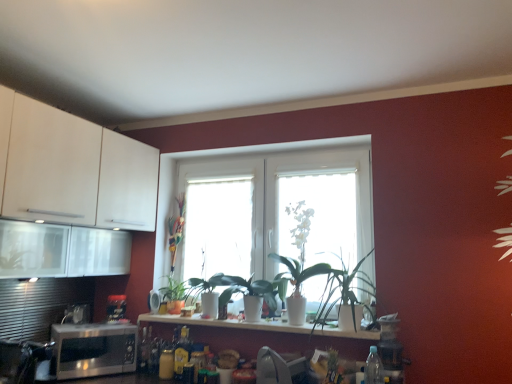
Describe the element at coordinates (225, 323) in the screenshot. I see `white glossy countertop at center` at that location.

Measure the distance between point (236, 230) and camera.

Point (236, 230) is 9.80 feet away from camera.

Measure the distance between white glossy window at center, the 2th window positioned from the left, and camera.

white glossy window at center, the 2th window positioned from the left, is 8.15 feet from camera.

Image resolution: width=512 pixels, height=384 pixels. Describe the element at coordinates (73, 169) in the screenshot. I see `white matte cabinet at upper left` at that location.

Where is `white glossy countertop at center`? Image resolution: width=512 pixels, height=384 pixels. white glossy countertop at center is located at coordinates (225, 323).

Who is bigger, white glossy vase at center, which is the fourth plant in left-to-right order, or transparent glass window at center, which is the third window in right-to-left order?

Bigger between the two is white glossy vase at center, which is the fourth plant in left-to-right order.

Could you tell me if white glossy vase at center, which is the fourth plant in left-to-right order, is turned towards transparent glass window at center, which is counted as the 1th window, starting from the left?

No, white glossy vase at center, which is the fourth plant in left-to-right order, is not facing towards transparent glass window at center, which is counted as the 1th window, starting from the left.

Considering the sizes of objects white glossy vase at center, the second plant viewed from the right, and transparent glass window at center, which is the third window in right-to-left order, in the image provided, who is wider, white glossy vase at center, the second plant viewed from the right, or transparent glass window at center, which is the third window in right-to-left order,?

white glossy vase at center, the second plant viewed from the right.

From the image's perspective, would you say metallic black toaster at lower left, the 2th appliance positioned from the left, is positioned over green glossy plant at center, which appears as the 3th plant when viewed from the left?

No, from the image's perspective, metallic black toaster at lower left, the 2th appliance positioned from the left, is not on top of green glossy plant at center, which appears as the 3th plant when viewed from the left.

Is metallic black toaster at lower left, the 2th appliance positioned from the left, to the left of green glossy plant at center, which appears as the 3th plant when viewed from the left, from the viewer's perspective?

Yes.

From the picture: In terms of height, does metallic black toaster at lower left, the 1th appliance from the right, look taller or shorter compared to green glossy plant at center, the 3th plant from the right?

Clearly, metallic black toaster at lower left, the 1th appliance from the right, is shorter compared to green glossy plant at center, the 3th plant from the right.

Is metallic black toaster at lower left, the 2th appliance positioned from the left, not close to green glossy plant at center, which appears as the 3th plant when viewed from the left?

Actually, metallic black toaster at lower left, the 2th appliance positioned from the left, and green glossy plant at center, which appears as the 3th plant when viewed from the left, are a little close together.

Does metallic black toaster at lower left, the 1th appliance from the right, touch satin silver toaster at lower left, the second appliance viewed from the right?

No, metallic black toaster at lower left, the 1th appliance from the right, is not next to satin silver toaster at lower left, the second appliance viewed from the right.

Which object is thinner, metallic black toaster at lower left, the 1th appliance from the right, or satin silver toaster at lower left, the second appliance viewed from the right?

With smaller width is satin silver toaster at lower left, the second appliance viewed from the right.

Is metallic black toaster at lower left, the 2th appliance positioned from the left, turned away from satin silver toaster at lower left, which appears as the first appliance when viewed from the left?

No, metallic black toaster at lower left, the 2th appliance positioned from the left,'s orientation is not away from satin silver toaster at lower left, which appears as the first appliance when viewed from the left.

In the scene shown: Between white matte cabinet at upper left and multicolored plastic plant at center, which appears as the 1th plant when viewed from the left, which one has more height?

white matte cabinet at upper left.

Is white matte cabinet at upper left at the left side of multicolored plastic plant at center, which appears as the 1th plant when viewed from the left?

Yes, white matte cabinet at upper left is to the left of multicolored plastic plant at center, which appears as the 1th plant when viewed from the left.

Based on the photo, is white matte cabinet at upper left spatially inside multicolored plastic plant at center, which appears as the 1th plant when viewed from the left, or outside of it?

white matte cabinet at upper left cannot be found inside multicolored plastic plant at center, which appears as the 1th plant when viewed from the left.

Locate an element on the screen. This screenshot has height=384, width=512. cabinetry above the multicolored plastic plant at center, which appears as the 1th plant when viewed from the left (from the image's perspective) is located at coordinates (73, 169).

Is green matte plant at center, which appears as the 5th plant when viewed from the left, at the back of white matte cabinet at upper left?

No, white matte cabinet at upper left's orientation is not away from green matte plant at center, which appears as the 5th plant when viewed from the left.

Based on the photo, from the image's perspective, is white matte cabinet at upper left under green matte plant at center, which appears as the 5th plant when viewed from the left?

No.

Is white matte cabinet at upper left inside the boundaries of green matte plant at center, positioned as the first plant in right-to-left order, or outside?

The correct answer is: outside.

Can you confirm if white matte cabinet at upper left is wider than green matte plant at center, which appears as the 5th plant when viewed from the left?

Yes.

Does white glossy vase at center, the second plant viewed from the right, have a larger size compared to green glossy plant at center, which appears as the 3th plant when viewed from the left?

Indeed, white glossy vase at center, the second plant viewed from the right, has a larger size compared to green glossy plant at center, which appears as the 3th plant when viewed from the left.

From a real-world perspective, is white glossy vase at center, the second plant viewed from the right, on green glossy plant at center, the 3th plant from the right?

Correct, in the physical world, white glossy vase at center, the second plant viewed from the right, is higher than green glossy plant at center, the 3th plant from the right.

Is white glossy vase at center, the second plant viewed from the right, surrounding green glossy plant at center, the 3th plant from the right?

Definitely not — green glossy plant at center, the 3th plant from the right, is not inside white glossy vase at center, the second plant viewed from the right.

Considering the sizes of objects white glossy vase at center, the second plant viewed from the right, and green glossy plant at center, the 3th plant from the right, in the image provided, who is thinner, white glossy vase at center, the second plant viewed from the right, or green glossy plant at center, the 3th plant from the right,?

green glossy plant at center, the 3th plant from the right, is thinner.

In the image, is white glossy vase at center, which is the fourth plant in left-to-right order, positioned in front of or behind white glossy vase at center, which ranks as the 1th window in right-to-left order?

In the image, white glossy vase at center, which is the fourth plant in left-to-right order, appears in front of white glossy vase at center, which ranks as the 1th window in right-to-left order.

Is white glossy vase at center, which is the fourth plant in left-to-right order, shorter than white glossy vase at center, the 3th window in the left-to-right sequence?

Yes.

Visually, is white glossy vase at center, the second plant viewed from the right, positioned to the left or to the right of white glossy vase at center, the 3th window in the left-to-right sequence?

white glossy vase at center, the second plant viewed from the right, is positioned on white glossy vase at center, the 3th window in the left-to-right sequence,'s left side.

How different are the orientations of white glossy vase at center, the second plant viewed from the right, and white glossy vase at center, which ranks as the 1th window in right-to-left order, in degrees?

There is a 0.725-degree angle between the facing directions of white glossy vase at center, the second plant viewed from the right, and white glossy vase at center, which ranks as the 1th window in right-to-left order.

There is a white glossy vase at center, the second plant viewed from the right. Where is `the 1st window above it (from a real-world perspective)`? The image size is (512, 384). the 1st window above it (from a real-world perspective) is located at coordinates (218, 227).

The image size is (512, 384). In order to click on the 3rd plant to the right of the metallic black toaster at lower left, the 1th appliance from the right, counting from the anchor's position in this screenshot , I will do `click(210, 295)`.

Looking at the image, which one is located closer to white glossy countertop at center, white glossy vase at center, the 3th window in the left-to-right sequence, or green matte plant at center, the 4th plant when ordered from right to left?

green matte plant at center, the 4th plant when ordered from right to left, is closer to white glossy countertop at center.

Based on their spatial positions, is green glossy plant at center, the 3th plant from the right, or white glossy vase at center, which ranks as the 1th window in right-to-left order, closer to satin silver toaster at lower left, the second appliance viewed from the right?

Among the two, green glossy plant at center, the 3th plant from the right, is located nearer to satin silver toaster at lower left, the second appliance viewed from the right.

Estimate the real-world distances between objects in this image. Which object is further from white glossy vase at center, which ranks as the 1th window in right-to-left order, green matte plant at center, positioned as the 2th plant in left-to-right order, or green glossy plant at center, which appears as the 3th plant when viewed from the left?

The object further to white glossy vase at center, which ranks as the 1th window in right-to-left order, is green matte plant at center, positioned as the 2th plant in left-to-right order.

From the image, which object appears to be farther from satin silver microwave at lower left, multicolored plastic plant at center, which is the fifth plant in right-to-left order, or transparent glass window at center, which is the third window in right-to-left order?

transparent glass window at center, which is the third window in right-to-left order, lies further to satin silver microwave at lower left than the other object.

Estimate the real-world distances between objects in this image. Which object is closer to white glossy countertop at center, metallic black toaster at lower left, the 1th appliance from the right, or white glossy vase at center, the second plant viewed from the right?

white glossy vase at center, the second plant viewed from the right, is positioned closer to the anchor white glossy countertop at center.

When comparing their distances from metallic black toaster at lower left, the 2th appliance positioned from the left, does white matte cabinet at upper left or green glossy plant at center, which appears as the 3th plant when viewed from the left, seem further?

white matte cabinet at upper left is positioned further to the anchor metallic black toaster at lower left, the 2th appliance positioned from the left.

Consider the image. Estimate the real-world distances between objects in this image. Which object is further from satin silver toaster at lower left, which appears as the first appliance when viewed from the left, white glossy vase at center, which is the fourth plant in left-to-right order, or green glossy plant at center, the 3th plant from the right?

white glossy vase at center, which is the fourth plant in left-to-right order, is further to satin silver toaster at lower left, which appears as the first appliance when viewed from the left.

Based on their spatial positions, is green matte plant at center, positioned as the first plant in right-to-left order, or white glossy window at center, which is the 2th window in right-to-left order, closer to multicolored plastic plant at center, which appears as the 1th plant when viewed from the left?

white glossy window at center, which is the 2th window in right-to-left order, is closer to multicolored plastic plant at center, which appears as the 1th plant when viewed from the left.

Locate an element on the screen. The width and height of the screenshot is (512, 384). appliance between satin silver toaster at lower left, which appears as the first appliance when viewed from the left, and white glossy vase at center, which ranks as the 1th window in right-to-left order, from left to right is located at coordinates (116, 308).

This screenshot has height=384, width=512. I want to click on countertop located between white matte cabinet at upper left and white glossy vase at center, which ranks as the 1th window in right-to-left order, in the left-right direction, so click(x=225, y=323).

Identify the location of plant between green glossy plant at center, which appears as the 3th plant when viewed from the left, and white glossy vase at center, which ranks as the 1th window in right-to-left order, from left to right. Image resolution: width=512 pixels, height=384 pixels. (300, 248).

Find the location of a particular element. This screenshot has width=512, height=384. appliance between satin silver toaster at lower left, the second appliance viewed from the right, and white glossy countertop at center is located at coordinates (116, 308).